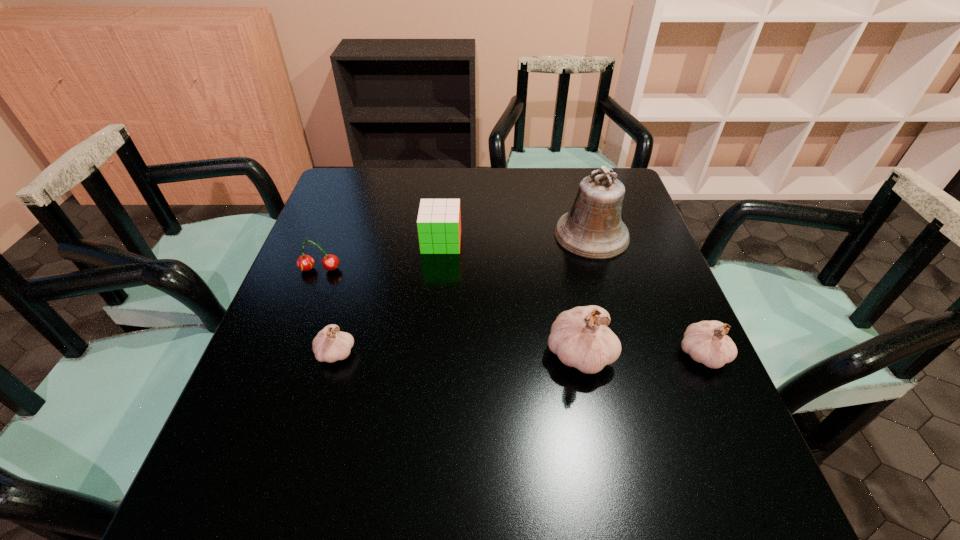
Find the location of `vacant space at the far edge of the desktop`. vacant space at the far edge of the desktop is located at coordinates (506, 168).

The image size is (960, 540). I want to click on blank area at the near edge, so [x=433, y=438].

At what (x,y) coordinates should I click in order to perform the action: click on free space at the right edge of the desktop. Please return your answer as a coordinate pair (x, y). Looking at the image, I should click on (623, 220).

You are a GUI agent. You are given a task and a screenshot of the screen. Output one action in this format:
    pyautogui.click(x=<x>, y=<y>)
    Task: Click on the vacant space at the far left corner
    The width and height of the screenshot is (960, 540).
    Given the screenshot: What is the action you would take?
    pyautogui.click(x=358, y=193)

Find the location of a particular element. free area in between the leftmost garlic and the second garlic from left to right is located at coordinates (458, 353).

You are a GUI agent. You are given a task and a screenshot of the screen. Output one action in this format:
    pyautogui.click(x=<x>, y=<y>)
    Task: Click on the free spot between the second object from left to right and the cherry
    This screenshot has height=540, width=960.
    Given the screenshot: What is the action you would take?
    click(x=328, y=310)

Identify the location of free space between the tallest garlic and the bell. This screenshot has height=540, width=960. (586, 294).

Locate an element on the screen. Image resolution: width=960 pixels, height=540 pixels. free space between the bell and the second garlic from right to left is located at coordinates (586, 294).

Find the location of a particular element. vacant area that lies between the cherry and the second garlic from right to left is located at coordinates (449, 312).

The width and height of the screenshot is (960, 540). What are the coordinates of `vacant area that lies between the third farthest object and the tallest garlic` in the screenshot? It's located at click(449, 312).